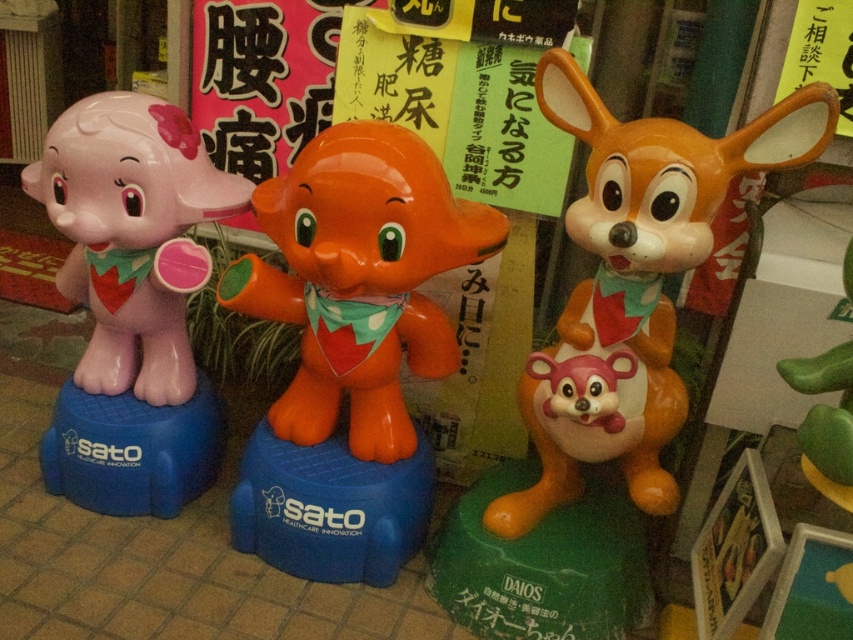
You are a customer at a store and see two toys on a shelf. You want to know which one is taller. Which toy is taller between the matte orange plush toy at center and the glossy plastic elephant at center?

The matte orange plush toy at center is taller than the glossy plastic elephant at center according to the description.

You are organizing a display of the matte orange plush toy at center and the matte plastic baby elephant at left. Which one requires a larger space on the shelf?

The matte orange plush toy at center is bigger than the matte plastic baby elephant at left, so it requires a larger space on the shelf.